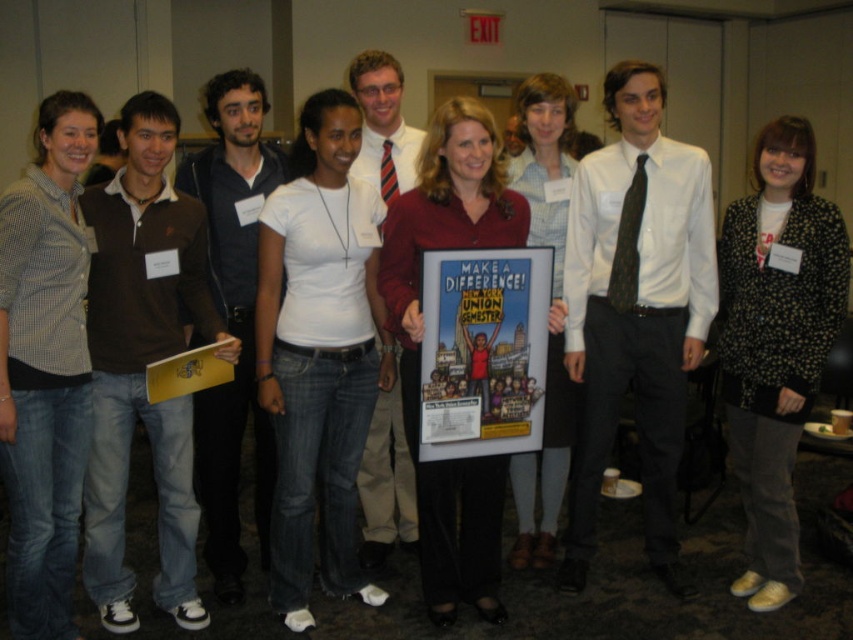
Question: Which is nearer to the cartoon-style poster at center?

Choices:
 (A) black dotted blazer at center
 (B) white matte shirt at center

Answer: (B)

Question: Is black dotted blazer at center above cartoon-style poster at center?

Choices:
 (A) no
 (B) yes

Answer: (A)

Question: Is white matte shirt at center below black dotted blazer at center?

Choices:
 (A) no
 (B) yes

Answer: (A)

Question: Which object is positioned farthest from the white matte shirt at center?

Choices:
 (A) cartoon-style poster at center
 (B) black dotted blazer at center

Answer: (B)

Question: Is black dotted blazer at center to the right of cartoon-style poster at center from the viewer's perspective?

Choices:
 (A) no
 (B) yes

Answer: (B)

Question: Which of these objects is positioned farthest from the cartoon-style poster at center?

Choices:
 (A) black dotted blazer at center
 (B) white matte shirt at center

Answer: (A)